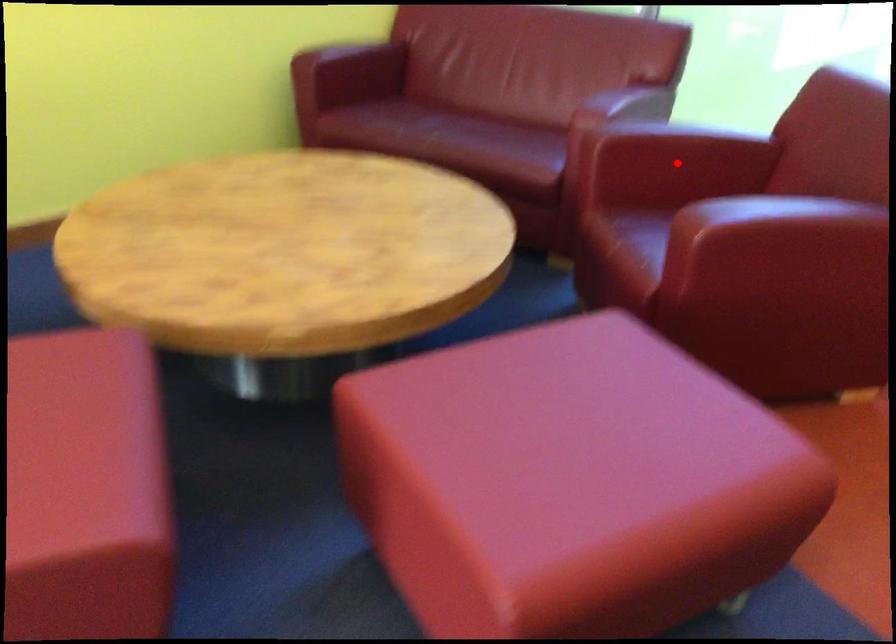
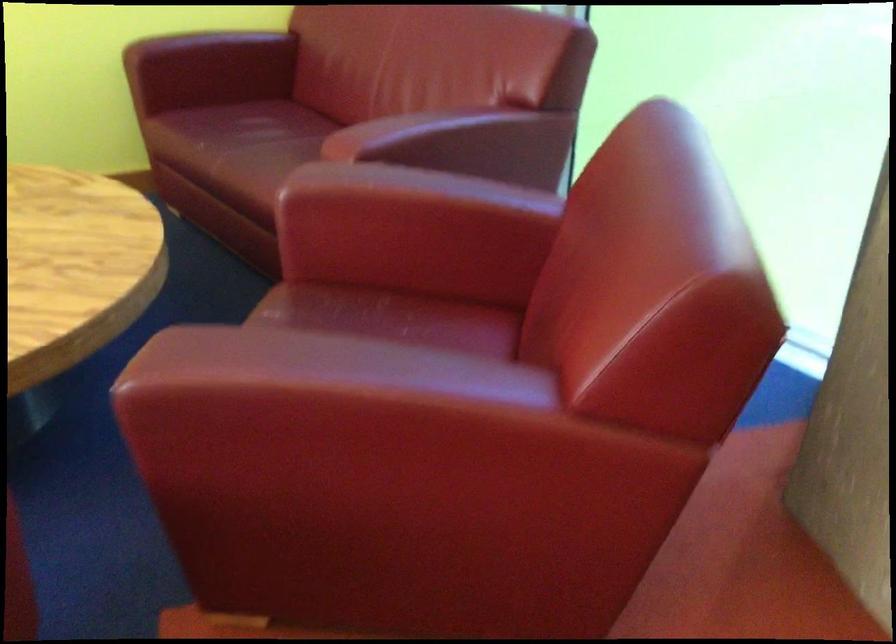
Question: A red point is marked in image1. In image2, is the corresponding 3D point closer to the camera or farther? Reply with the corresponding letter.

Choices:
 (A) The corresponding 3D point is closer.
 (B) The corresponding 3D point is farther.

Answer: (A)